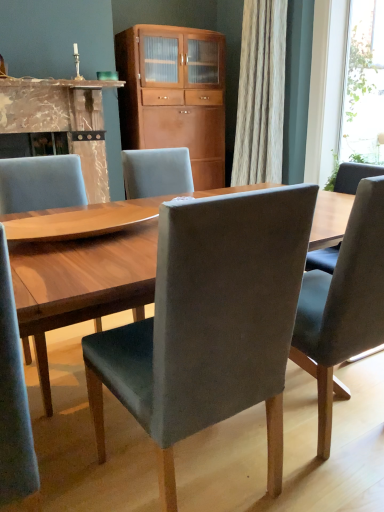
Question: Visually, is transparent glass window at upper right positioned to the left or to the right of marble fireplace at left?

Choices:
 (A) left
 (B) right

Answer: (B)

Question: Is point (357, 120) positioned closer to the camera than point (99, 148)?

Choices:
 (A) closer
 (B) farther

Answer: (B)

Question: Which of these objects is positioned farthest from the velvet grey chair at center, placed as the 2th chair when sorted from right to left?

Choices:
 (A) velvet grey chair at center, the 1th chair in the right-to-left sequence
 (B) wooden cabinet at center
 (C) marble fireplace at left
 (D) transparent glass window at upper right
 (E) matte gray chair at center, the third chair in the right-to-left sequence

Answer: (D)

Question: Estimate the real-world distances between objects in this image. Which object is farther from the matte gray chair at center, the 1th chair from the left?

Choices:
 (A) marble fireplace at left
 (B) transparent glass window at upper right
 (C) velvet grey chair at center, marked as the 3th chair in a left-to-right arrangement
 (D) wooden cabinet at center
 (E) velvet grey chair at center, which is the 2th chair from left to right

Answer: (B)